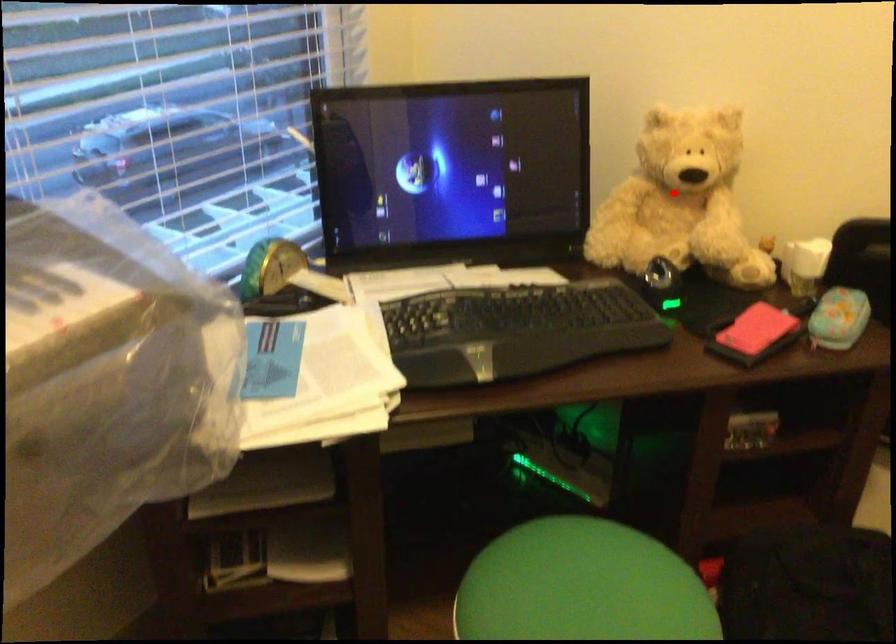
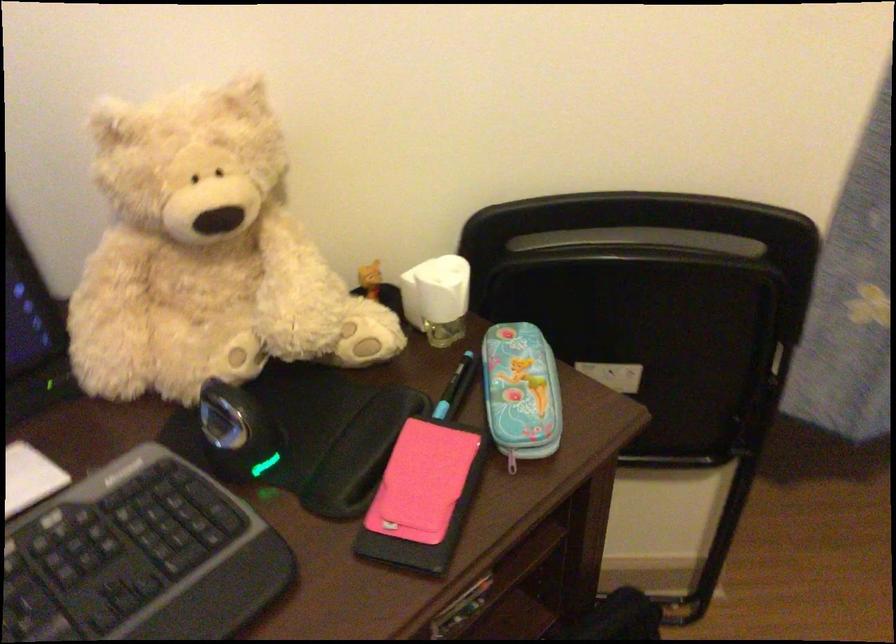
Question: I am providing you with two images of the same scene from different viewpoints. Given a red point in image1, look at the same physical point in image2. Is it:

Choices:
 (A) Closer to the viewpoint
 (B) Farther from the viewpoint

Answer: (A)